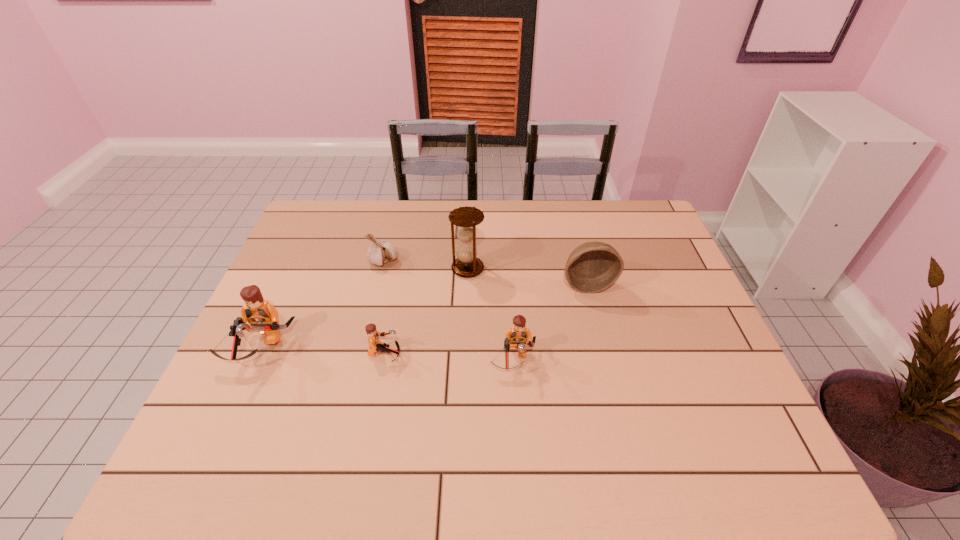
Identify the location of free point at the near right corner. (754, 428).

The image size is (960, 540). I want to click on free area in between the bowl and the leftmost object, so click(423, 316).

Locate an element on the screen. This screenshot has width=960, height=540. free area in between the garlic and the hourglass is located at coordinates (426, 265).

Locate an element on the screen. Image resolution: width=960 pixels, height=540 pixels. vacant area that lies between the tallest Lego and the garlic is located at coordinates (322, 305).

In order to click on free spot between the rightmost object and the second object from right to left in this screenshot , I will do pyautogui.click(x=550, y=322).

This screenshot has width=960, height=540. What are the coordinates of `vacant space in between the shortest Lego and the garlic` in the screenshot? It's located at (385, 308).

This screenshot has height=540, width=960. I want to click on vacant area that lies between the hourglass and the second shortest Lego, so click(491, 314).

Image resolution: width=960 pixels, height=540 pixels. Identify the location of vacant space that is in between the tallest Lego and the rightmost object. (423, 316).

Where is `vacant point located between the garlic and the shortest Lego`? vacant point located between the garlic and the shortest Lego is located at coordinates (385, 308).

The image size is (960, 540). I want to click on unoccupied area between the second Lego from left to right and the third object from right to left, so click(x=426, y=312).